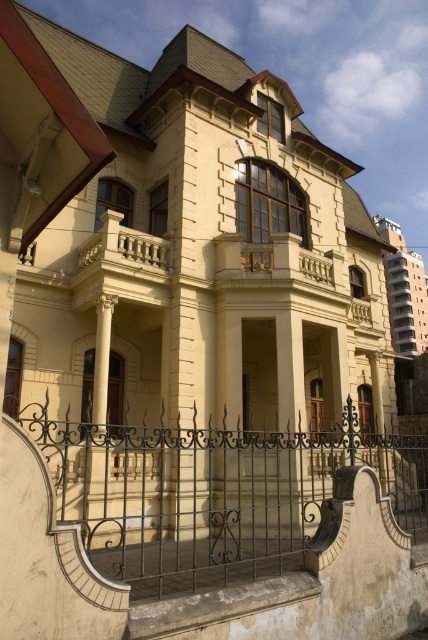
Between green wrought iron gate at lower center and white glossy column at center, which one has less height?

white glossy column at center

Does point (202, 444) come closer to viewer compared to point (98, 390)?

Yes, it is.

Between point (127, 524) and point (109, 333), which one is positioned behind?

The point (109, 333) is behind.

Image resolution: width=428 pixels, height=640 pixels. What are the coordinates of `green wrought iron gate at lower center` in the screenshot? It's located at (213, 493).